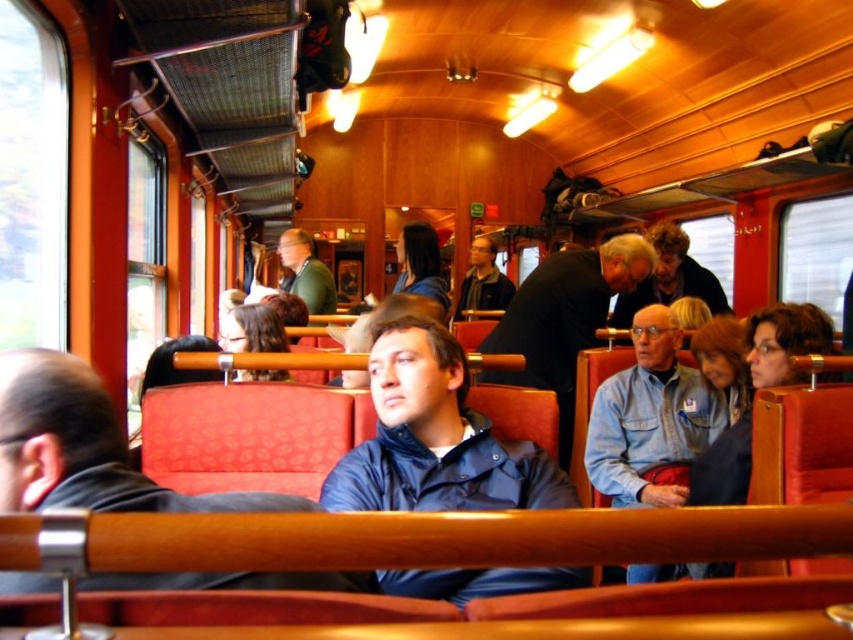
Is blue matte jacket at center wider than black leather coat at center?

No.

Is blue matte jacket at center behind black leather coat at center?

No, blue matte jacket at center is in front of black leather coat at center.

In the scene shown: Who is more forward, (410, 465) or (514, 328)?

Point (410, 465) is in front.

This screenshot has height=640, width=853. I want to click on blue matte jacket at center, so click(434, 436).

Between point (83, 433) and point (506, 276), which one is positioned in front?

Point (83, 433)

Is point (80, 385) closer to viewer compared to point (473, 240)?

Yes, it is.

Where is `matte blue jacket at center`? matte blue jacket at center is located at coordinates (84, 448).

Does black leather coat at center appear on the right side of green fabric jacket at center?

Indeed, black leather coat at center is positioned on the right side of green fabric jacket at center.

Who is shorter, black leather coat at center or green fabric jacket at center?

With less height is green fabric jacket at center.

Who is more distant from viewer, (595, 326) or (305, 276)?

The point (305, 276) is behind.

You are a GUI agent. You are given a task and a screenshot of the screen. Output one action in this format:
    pyautogui.click(x=<x>, y=<y>)
    Task: Click on the black leather coat at center
    The image size is (853, 640).
    Given the screenshot: What is the action you would take?
    pyautogui.click(x=564, y=320)